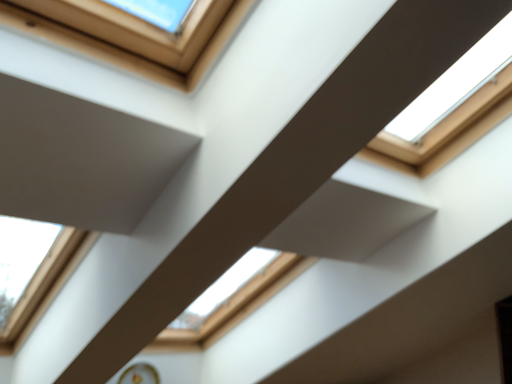
Identify the location of wooden frame at upper left. (133, 35).

Measure the distance between point (33, 6) and camera.

Point (33, 6) is 30.71 inches from camera.

This screenshot has width=512, height=384. What do you see at coordinates (133, 35) in the screenshot? I see `wooden frame at upper left` at bounding box center [133, 35].

I want to click on wooden frame at upper left, so click(133, 35).